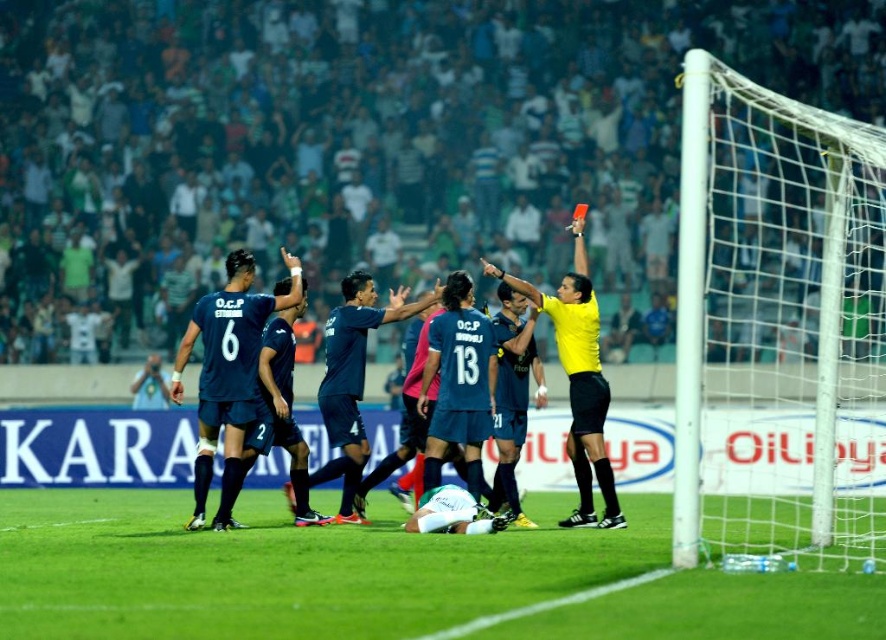
Is point (694, 480) closer to camera compared to point (424, 301)?

Yes, it is.

Is white mesh net at right positioned in front of dark blue jersey at center?

Yes, it is.

Is point (850, 436) positioned in front of point (581, 380)?

No, (850, 436) is behind (581, 380).

Where is `white mesh net at right`? white mesh net at right is located at coordinates (776, 332).

Between white mesh net at right and yellow jersey at center, which one is positioned lower?

Positioned lower is yellow jersey at center.

Is point (805, 404) behind point (561, 298)?

Yes, point (805, 404) is behind point (561, 298).

Where is `white mesh net at right`? This screenshot has width=886, height=640. white mesh net at right is located at coordinates (776, 332).

This screenshot has width=886, height=640. Identify the location of white mesh net at right. (776, 332).

Between dark blue jersey at center and yellow jersey at center, which one has more height?

yellow jersey at center is taller.

Does dark blue jersey at center lie in front of yellow jersey at center?

No.

This screenshot has width=886, height=640. I want to click on dark blue jersey at center, so click(584, 374).

Where is `dark blue jersey at center`? dark blue jersey at center is located at coordinates (584, 374).